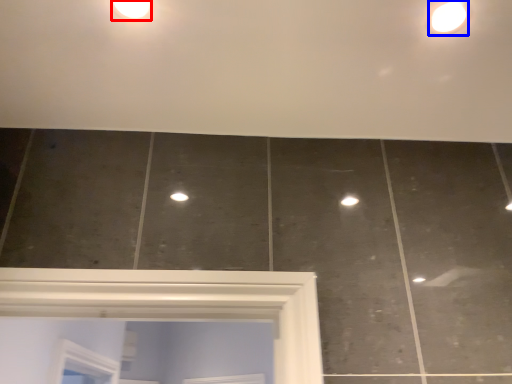
Question: Which object is closer to the camera taking this photo, droplight (highlighted by a red box) or light fixture (highlighted by a blue box)?

Choices:
 (A) droplight
 (B) light fixture

Answer: (A)